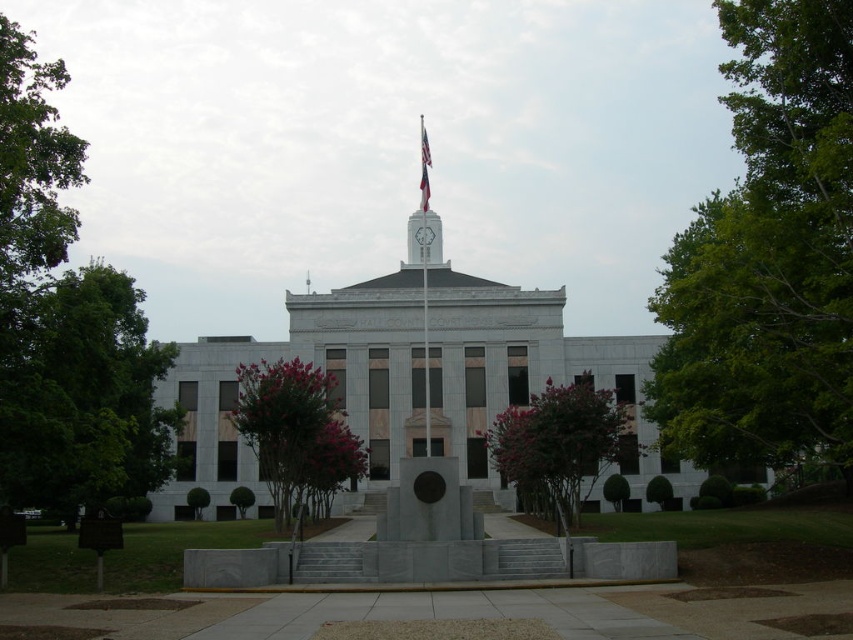
Question: Is purple leafy tree at center wider than white fabric flag at center?

Choices:
 (A) no
 (B) yes

Answer: (B)

Question: Which object appears closest to the camera in this image?

Choices:
 (A) green leafy tree at right
 (B) metallic flag pole at center
 (C) purple leafy tree at center
 (D) green leafy tree at left

Answer: (A)

Question: Which point is closer to the camera taking this photo?

Choices:
 (A) (544, 481)
 (B) (425, 141)
 (C) (306, 384)

Answer: (C)

Question: Which object appears closest to the camera in this image?

Choices:
 (A) green leafy tree at left
 (B) white fabric flag at center
 (C) purple leafy tree at center
 (D) purple-leaved tree at center

Answer: (A)

Question: In this image, where is green leafy tree at right located relative to green leafy tree at left?

Choices:
 (A) left
 (B) right

Answer: (B)

Question: Is green leafy tree at left above purple-leaved tree at center?

Choices:
 (A) no
 (B) yes

Answer: (B)